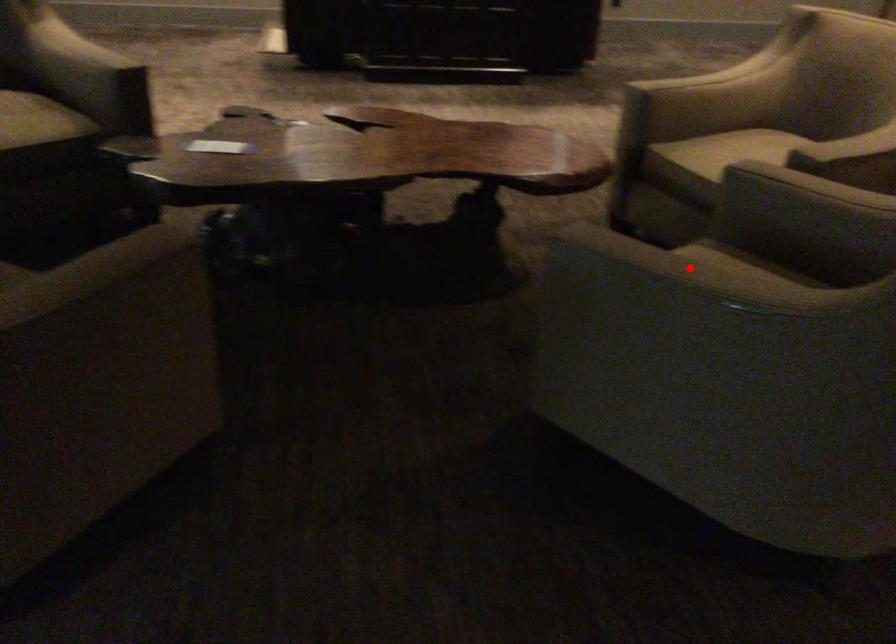
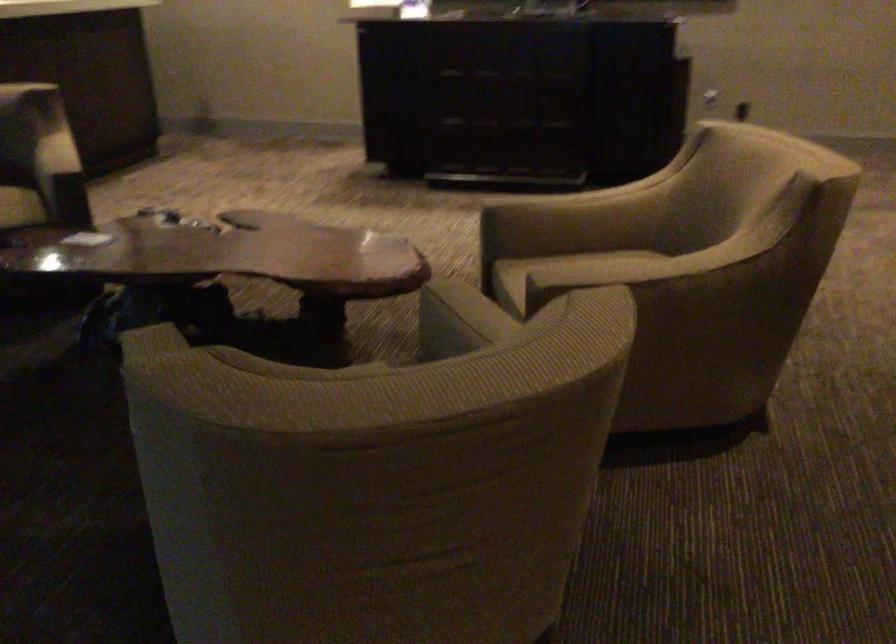
Question: I am providing you with two images of the same scene from different viewpoints. A red point is marked on the first image. At the location where the point appears in image 1, is it still visible in image 2?

Choices:
 (A) Yes
 (B) No

Answer: (B)